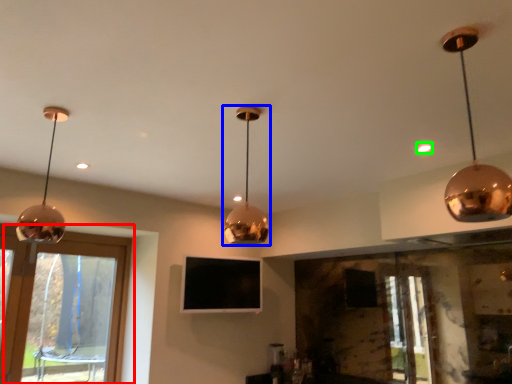
Question: Which object is the closest to the window (highlighted by a red box)? Choose among these: lamp (highlighted by a blue box) or glow (highlighted by a green box).

Choices:
 (A) lamp
 (B) glow

Answer: (A)